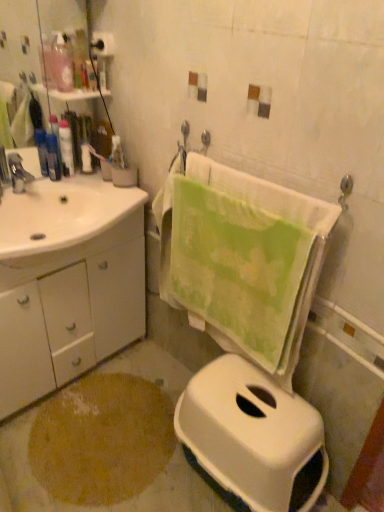
In order to face translucent plastic bottle at upper left, arranged as the 3th toiletry when viewed from the left, should I rotate leftwards or rightwards?

Turn left approximately 13.107 degrees to face it.

Describe the element at coordinates (91, 75) in the screenshot. I see `translucent plastic bottle at upper left, placed as the third toiletry when sorted from bottom to top` at that location.

The height and width of the screenshot is (512, 384). In order to click on matte black lotion at left, which appears as the second toiletry when viewed from the left in this screenshot , I will do `click(66, 148)`.

Locate an element on the screen. This screenshot has height=512, width=384. matte silver faucet at left is located at coordinates (18, 173).

Is brown textured rug at lower left oriented away from white plastic toilet at lower right?

brown textured rug at lower left does not have its back to white plastic toilet at lower right.

Is brown textured rug at lower left not within white plastic toilet at lower right?

Indeed, brown textured rug at lower left is completely outside white plastic toilet at lower right.

Is brown textured rug at lower left shorter than white plastic toilet at lower right?

Yes.

Is translucent plastic bottle at upper left, the first toiletry positioned from the top, wider or thinner than green cotton towel at center?

Considering their sizes, translucent plastic bottle at upper left, the first toiletry positioned from the top, looks slimmer than green cotton towel at center.

Is translucent plastic bottle at upper left, placed as the 1th toiletry when sorted from right to left, further to the viewer compared to green cotton towel at center?

Yes, it is.

Which is nearer, (88, 81) or (259, 271)?

The point (259, 271) is closer to the camera.

Considering the relative positions of translucent plastic bottle at upper left, the first toiletry positioned from the top, and green cotton towel at center in the image provided, is translucent plastic bottle at upper left, the first toiletry positioned from the top, to the left of green cotton towel at center from the viewer's perspective?

Yes, translucent plastic bottle at upper left, the first toiletry positioned from the top, is to the left of green cotton towel at center.

Looking at this image, which point is more forward, (314,483) or (121,202)?

The point (314,483) is closer.

From the picture: Considering the relative positions of white plastic toilet at lower right and white glossy sink at left in the image provided, is white plastic toilet at lower right to the right of white glossy sink at left from the viewer's perspective?

Yes.

Is the position of white plastic toilet at lower right less distant than that of white glossy sink at left?

Yes, the depth of white plastic toilet at lower right is less than that of white glossy sink at left.

Considering the relative sizes of matte black lotion at left, which appears as the second toiletry when viewed from the left, and white plastic toilet at lower right in the image provided, is matte black lotion at left, which appears as the second toiletry when viewed from the left, thinner than white plastic toilet at lower right?

Correct, the width of matte black lotion at left, which appears as the second toiletry when viewed from the left, is less than that of white plastic toilet at lower right.

Is point (61, 133) closer to viewer compared to point (263, 381)?

No, it is not.

Is matte black lotion at left, the 2th toiletry positioned from the top, surrounding white plastic toilet at lower right?

That's incorrect, white plastic toilet at lower right is not inside matte black lotion at left, the 2th toiletry positioned from the top.

Which object is closer to the camera taking this photo, matte black lotion at left, which appears as the second toiletry when viewed from the left, or white plastic toilet at lower right?

white plastic toilet at lower right is in front.

Is translucent plastic bottle at upper left, the first toiletry positioned from the top, positioned with its back to matte black lotion at left, placed as the 3th toiletry when sorted from top to bottom?

No, matte black lotion at left, placed as the 3th toiletry when sorted from top to bottom, is not at the back of translucent plastic bottle at upper left, the first toiletry positioned from the top.

Which of these two, translucent plastic bottle at upper left, arranged as the 3th toiletry when viewed from the left, or matte black lotion at left, which is counted as the 3th toiletry, starting from the right, is thinner?

translucent plastic bottle at upper left, arranged as the 3th toiletry when viewed from the left.

Measure the distance from translucent plastic bottle at upper left, the first toiletry positioned from the top, to matte black lotion at left, which appears as the first toiletry when ordered from the bottom.

translucent plastic bottle at upper left, the first toiletry positioned from the top, and matte black lotion at left, which appears as the first toiletry when ordered from the bottom, are 12.36 inches apart from each other.

In the scene shown: Is translucent plastic bottle at upper left, placed as the 1th toiletry when sorted from right to left, located outside matte black lotion at left, placed as the 3th toiletry when sorted from top to bottom?

Yes, translucent plastic bottle at upper left, placed as the 1th toiletry when sorted from right to left, is outside of matte black lotion at left, placed as the 3th toiletry when sorted from top to bottom.

Is white glossy cabinet at left positioned beyond the bounds of green cotton towel at center?

Indeed, white glossy cabinet at left is completely outside green cotton towel at center.

Considering their positions, is white glossy cabinet at left located in front of or behind green cotton towel at center?

Clearly, white glossy cabinet at left is behind green cotton towel at center.

From the picture: Between white glossy cabinet at left and green cotton towel at center, which one has more height?

With more height is white glossy cabinet at left.

Could you tell me if white glossy cabinet at left is turned towards green cotton towel at center?

Yes, white glossy cabinet at left is oriented towards green cotton towel at center.

From a real-world perspective, is white plastic toilet at lower right physically located above or below matte black lotion at left, the 2th toiletry positioned from the top?

white plastic toilet at lower right is below matte black lotion at left, the 2th toiletry positioned from the top.

Is white plastic toilet at lower right in front of matte black lotion at left, the 2th toiletry positioned from the top?

Yes, white plastic toilet at lower right is closer to the viewer.

Would you consider white plastic toilet at lower right to be distant from matte black lotion at left, the 2th toiletry positioned from the top?

Yes.

The image size is (384, 512). In the image, there is a white plastic toilet at lower right. Find the location of `powder below it (from the image's perspective)`. powder below it (from the image's perspective) is located at coordinates click(x=102, y=439).

Where is `bath towel beneath the translucent plastic bottle at upper left, arranged as the 3th toiletry when viewed from the left (from a real-world perspective)`? Image resolution: width=384 pixels, height=512 pixels. bath towel beneath the translucent plastic bottle at upper left, arranged as the 3th toiletry when viewed from the left (from a real-world perspective) is located at coordinates (237, 269).

Consider the image. Which object lies further to the anchor point matte black lotion at left, which appears as the first toiletry when ordered from the bottom, matte black lotion at left, the 2th toiletry positioned from the top, or matte silver faucet at left?

Based on the image, matte silver faucet at left appears to be further to matte black lotion at left, which appears as the first toiletry when ordered from the bottom.

Based on the photo, considering their positions, is translucent plastic bottle at upper left, arranged as the 3th toiletry when viewed from the left, positioned closer to green cotton towel at center than matte silver faucet at left?

Among the two, matte silver faucet at left is located nearer to green cotton towel at center.

From the image, which object appears to be nearer to matte black lotion at left, which ranks as the second toiletry in bottom-to-top order, brown textured rug at lower left or white plastic toilet at lower right?

Based on the image, brown textured rug at lower left appears to be nearer to matte black lotion at left, which ranks as the second toiletry in bottom-to-top order.

Estimate the real-world distances between objects in this image. Which object is further from white glossy cabinet at left, brown textured rug at lower left or white glossy sink at left?

brown textured rug at lower left lies further to white glossy cabinet at left than the other object.

Looking at the image, which one is located further to translucent plastic bottle at upper left, arranged as the 3th toiletry when viewed from the left, white plastic toilet at lower right or matte silver faucet at left?

white plastic toilet at lower right is further to translucent plastic bottle at upper left, arranged as the 3th toiletry when viewed from the left.

Which object lies nearer to the anchor point matte black lotion at left, which appears as the second toiletry when viewed from the left, green cotton towel at center or brown textured rug at lower left?

green cotton towel at center.

Considering their positions, is white glossy sink at left positioned closer to matte black lotion at left, which is the 1th toiletry in left-to-right order, than white plastic toilet at lower right?

white glossy sink at left is positioned closer to the anchor matte black lotion at left, which is the 1th toiletry in left-to-right order.

Estimate the real-world distances between objects in this image. Which object is closer to matte black lotion at left, which appears as the second toiletry when viewed from the left, white glossy cabinet at left or brown textured rug at lower left?

Among the two, white glossy cabinet at left is located nearer to matte black lotion at left, which appears as the second toiletry when viewed from the left.

Identify the location of tap between white glossy sink at left and matte black lotion at left, the 2th toiletry positioned from the top, from front to back. (18, 173).

In order to click on tap between translucent plastic bottle at upper left, placed as the 1th toiletry when sorted from right to left, and white glossy cabinet at left vertically in this screenshot , I will do `click(18, 173)`.

I want to click on sink between matte black lotion at left, placed as the 3th toiletry when sorted from top to bottom, and brown textured rug at lower left, in the vertical direction, so click(x=60, y=216).

Locate an element on the screen. tap between translucent plastic bottle at upper left, placed as the third toiletry when sorted from bottom to top, and brown textured rug at lower left from top to bottom is located at coordinates (18, 173).